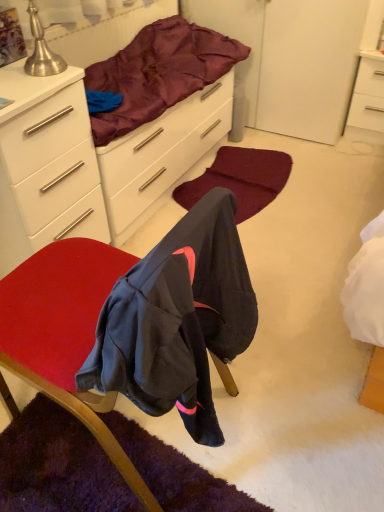
Question: Should I look upward or downward to see white matte cabinet at upper left?

Choices:
 (A) down
 (B) up

Answer: (B)

Question: Is white matte cabinet at upper left wider than velvet-like red chair at center?

Choices:
 (A) no
 (B) yes

Answer: (A)

Question: From the image's perspective, is white matte cabinet at upper left beneath velvet-like red chair at center?

Choices:
 (A) no
 (B) yes

Answer: (A)

Question: Is white matte cabinet at upper left looking in the opposite direction of velvet-like red chair at center?

Choices:
 (A) yes
 (B) no

Answer: (B)

Question: From a real-world perspective, is white matte cabinet at upper left on velvet-like red chair at center?

Choices:
 (A) yes
 (B) no

Answer: (B)

Question: Does white matte cabinet at upper left lie in front of velvet-like red chair at center?

Choices:
 (A) yes
 (B) no

Answer: (B)

Question: Is white matte cabinet at upper left bigger than velvet-like red chair at center?

Choices:
 (A) yes
 (B) no

Answer: (B)

Question: From the image's perspective, is silky purple blanket at upper center under white glossy nightstand at upper right?

Choices:
 (A) yes
 (B) no

Answer: (A)

Question: Is white glossy nightstand at upper right at the back of silky purple blanket at upper center?

Choices:
 (A) no
 (B) yes

Answer: (A)

Question: Does silky purple blanket at upper center have a lesser width compared to white glossy nightstand at upper right?

Choices:
 (A) yes
 (B) no

Answer: (B)

Question: Does silky purple blanket at upper center have a greater width compared to white glossy nightstand at upper right?

Choices:
 (A) yes
 (B) no

Answer: (A)

Question: From a real-world perspective, does silky purple blanket at upper center sit lower than white glossy nightstand at upper right?

Choices:
 (A) yes
 (B) no

Answer: (B)

Question: Are silky purple blanket at upper center and white glossy nightstand at upper right located far from each other?

Choices:
 (A) yes
 (B) no

Answer: (B)

Question: Can you confirm if silky purple blanket at upper center is thinner than burgundy carpet at center?

Choices:
 (A) yes
 (B) no

Answer: (A)